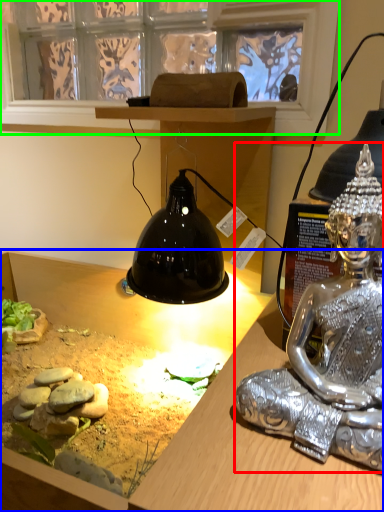
Question: Which is farther away from person (highlighted by a red box)? desk (highlighted by a blue box) or window screen (highlighted by a green box)?

Choices:
 (A) desk
 (B) window screen

Answer: (B)